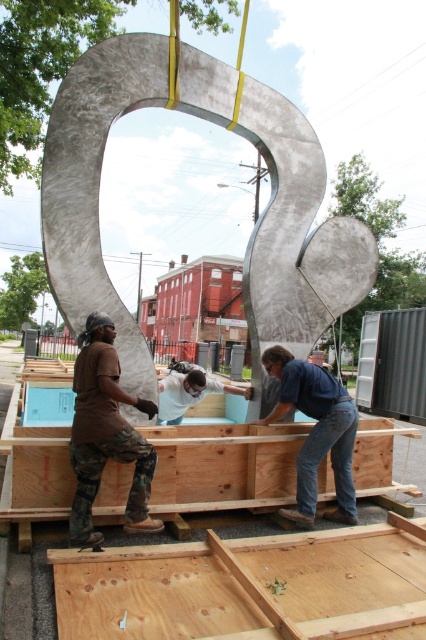
Who is shorter, light brown wooden crate at lower center or blue jeans at center?

Standing shorter between the two is light brown wooden crate at lower center.

Is point (186, 545) closer to camera compared to point (264, 355)?

Yes, it is.

Is point (285, 618) more distant than point (299, 364)?

That is False.

Where is `light brown wooden crate at lower center`? The image size is (426, 640). light brown wooden crate at lower center is located at coordinates (244, 586).

Is the position of light brown wooden crate at lower center less distant than that of wooden crates at center?

Yes, it is in front of wooden crates at center.

The image size is (426, 640). Identify the location of light brown wooden crate at lower center. (244, 586).

The image size is (426, 640). Describe the element at coordinates (244, 586) in the screenshot. I see `light brown wooden crate at lower center` at that location.

Where is `light brown wooden crate at lower center`? This screenshot has width=426, height=640. light brown wooden crate at lower center is located at coordinates (244, 586).

Based on the photo, between brushed metal sculpture at center and blue jeans at center, which one has less height?

blue jeans at center is shorter.

Is point (60, 291) positioned before point (351, 410)?

That is False.

Find the location of a particular element. This screenshot has width=426, height=640. brushed metal sculpture at center is located at coordinates (279, 218).